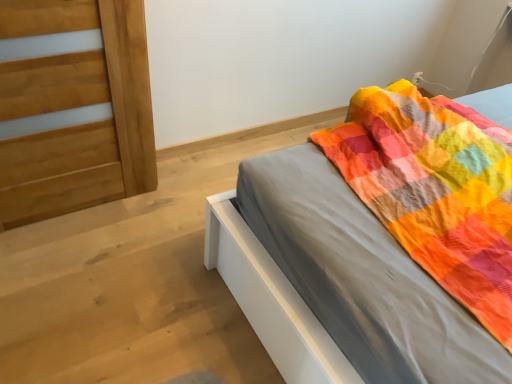
Locate an element on the screen. The width and height of the screenshot is (512, 384). free spot below light brown wood door at left (from a real-world perspective) is located at coordinates (83, 211).